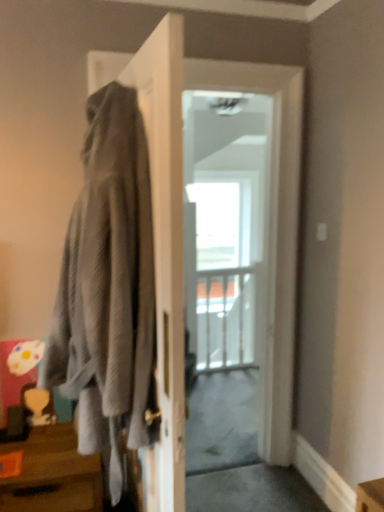
Question: From the image's perspective, relative to gray textured hoodie at left, is transparent glass door at center above or below?

Choices:
 (A) above
 (B) below

Answer: (A)

Question: From a real-world perspective, is transparent glass door at center physically located above or below gray textured hoodie at left?

Choices:
 (A) above
 (B) below

Answer: (B)

Question: Which object is positioned closest to the gray textured hoodie at left?

Choices:
 (A) brown wood table at lower left
 (B) transparent glass door at center
 (C) white glossy door at center

Answer: (A)

Question: Which of these objects is positioned closest to the white glossy door at center?

Choices:
 (A) transparent glass door at center
 (B) brown wood table at lower left
 (C) gray textured hoodie at left

Answer: (C)